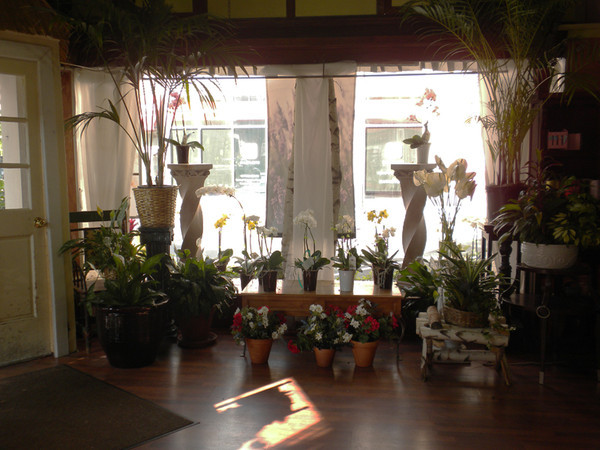
Identify the location of light reflection on the floor. This screenshot has width=600, height=450. (288, 425).